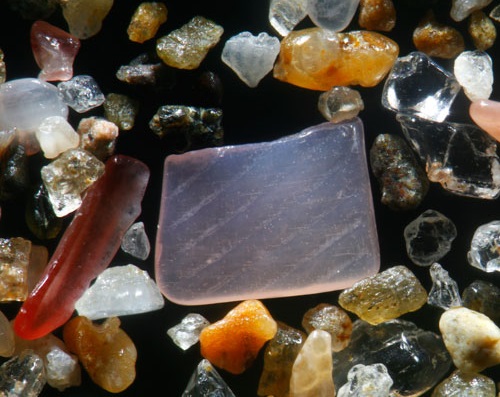
Identify the location of corner. (370, 272), (180, 298), (173, 159), (349, 127).